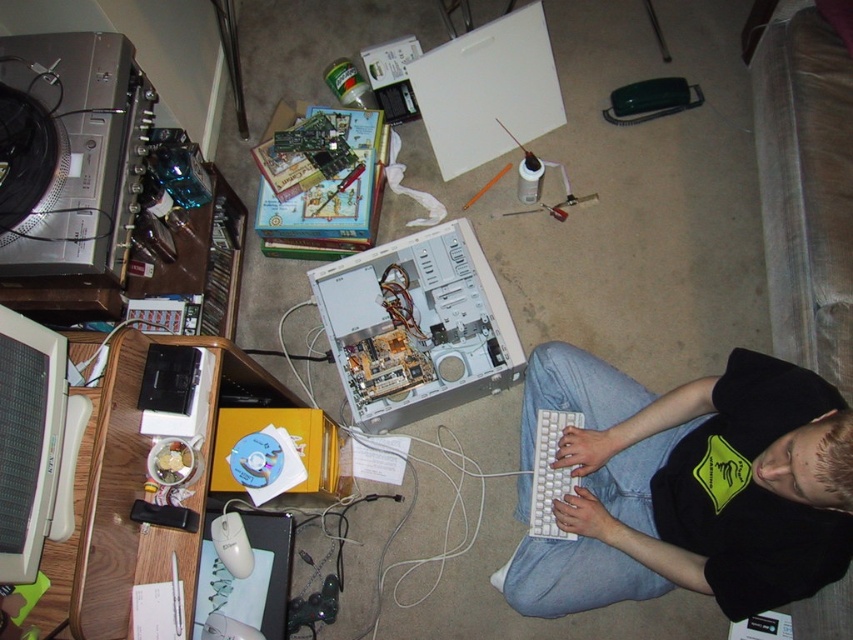
From the picture: Between white matte keyboard at lower center and white plastic mouse at lower left, which one has more height?

Standing taller between the two is white matte keyboard at lower center.

Does white matte keyboard at lower center have a smaller size compared to white plastic mouse at lower left?

Incorrect, white matte keyboard at lower center is not smaller in size than white plastic mouse at lower left.

Is point (630, 413) behind point (238, 570)?

Yes, point (630, 413) is farther from viewer.

At what (x,y) coordinates should I click in order to perform the action: click on white matte keyboard at lower center. Please return your answer as a coordinate pair (x, y). Looking at the image, I should click on (688, 486).

I want to click on white plastic computer case at center, so click(x=416, y=326).

Which is more to the right, white plastic computer case at center or white plastic mouse at lower left?

Positioned to the right is white plastic computer case at center.

Does point (375, 387) come behind point (215, 518)?

Yes, point (375, 387) is farther from viewer.

Where is `white plastic computer case at center`? white plastic computer case at center is located at coordinates (416, 326).

Which is behind, point (486, 369) or point (549, 428)?

Positioned behind is point (486, 369).

Locate an element on the screen. This screenshot has width=853, height=640. white plastic computer case at center is located at coordinates (416, 326).

This screenshot has height=640, width=853. Describe the element at coordinates (416, 326) in the screenshot. I see `white plastic computer case at center` at that location.

Find the location of a particular element. white plastic computer case at center is located at coordinates (416, 326).